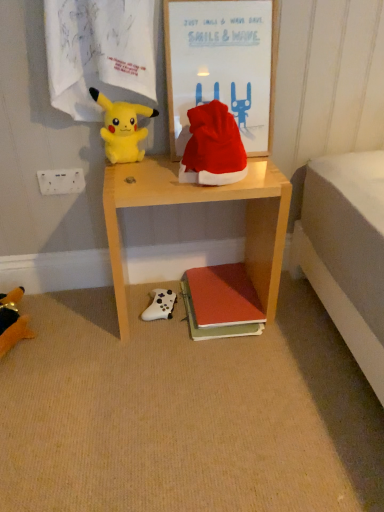
Locate an element on the screen. Image resolution: width=384 pixels, height=512 pixels. wooden desk at center is located at coordinates (200, 202).

From the picture: Measure the distance between point (22, 324) and camera.

They are 1.37 meters apart.

Measure the distance between matte orange book at lower center and camera.

A distance of 4.39 feet exists between matte orange book at lower center and camera.

Describe the element at coordinates (221, 302) in the screenshot. I see `matte orange book at lower center` at that location.

This screenshot has height=512, width=384. I want to click on yellow plush toy at upper left, placed as the 2th toy when sorted from right to left, so click(122, 128).

What do you see at coordinates (122, 128) in the screenshot?
I see `yellow plush toy at upper left, the 2th toy when ordered from left to right` at bounding box center [122, 128].

Locate an element on the screen. white matte game controller at lower center, the first toy positioned from the right is located at coordinates (160, 305).

Would you consider wooden framed poster at upper center to be distant from red velvet santa hat at center?

wooden framed poster at upper center is actually quite close to red velvet santa hat at center.

Can you confirm if wooden framed poster at upper center is thinner than red velvet santa hat at center?

Yes, wooden framed poster at upper center is thinner than red velvet santa hat at center.

Is wooden framed poster at upper center oriented towards red velvet santa hat at center?

Yes, wooden framed poster at upper center faces towards red velvet santa hat at center.

How much distance is there between wooden framed poster at upper center and red velvet santa hat at center?

wooden framed poster at upper center and red velvet santa hat at center are 7.90 inches apart.

Measure the distance between soft plush toy at lower left, positioned as the first toy in left-to-right order, and yellow plush toy at upper left, the 2th toy when ordered from left to right.

soft plush toy at lower left, positioned as the first toy in left-to-right order, and yellow plush toy at upper left, the 2th toy when ordered from left to right, are 64.40 centimeters apart.

Is soft plush toy at lower left, positioned as the first toy in left-to-right order, located outside yellow plush toy at upper left, the 2th toy when ordered from left to right?

Indeed, soft plush toy at lower left, positioned as the first toy in left-to-right order, is completely outside yellow plush toy at upper left, the 2th toy when ordered from left to right.

In the scene shown: Which of these two, soft plush toy at lower left, the 3th toy when ordered from top to bottom, or yellow plush toy at upper left, which ranks as the 3th toy in bottom-to-top order, is wider?

With larger width is soft plush toy at lower left, the 3th toy when ordered from top to bottom.

Which object is more forward, white matte game controller at lower center, acting as the third toy starting from the left, or red velvet santa hat at center?

red velvet santa hat at center is closer to the camera.

How different are the orientations of white matte game controller at lower center, acting as the third toy starting from the left, and red velvet santa hat at center in degrees?

13.6 degrees separate the facing orientations of white matte game controller at lower center, acting as the third toy starting from the left, and red velvet santa hat at center.

From the picture: Which of these two, white matte game controller at lower center, which ranks as the 2th toy in bottom-to-top order, or red velvet santa hat at center, is wider?

white matte game controller at lower center, which ranks as the 2th toy in bottom-to-top order, is wider.

From the image's perspective, is white matte game controller at lower center, acting as the third toy starting from the left, over red velvet santa hat at center?

→ No.

Is matte orange book at lower center turned away from white matte game controller at lower center, the first toy positioned from the right?

That's not correct — matte orange book at lower center is not looking away from white matte game controller at lower center, the first toy positioned from the right.

This screenshot has width=384, height=512. In order to click on book in front of the white matte game controller at lower center, which ranks as the 2th toy in bottom-to-top order in this screenshot , I will do `click(221, 302)`.

Does point (239, 295) lie in front of point (152, 293)?

Yes, point (239, 295) is closer to viewer.

Would you say matte orange book at lower center contains white matte game controller at lower center, acting as the third toy starting from the left?

No, white matte game controller at lower center, acting as the third toy starting from the left, is located outside of matte orange book at lower center.

Is red velvet santa hat at center positioned before white matte game controller at lower center, which ranks as the 2th toy in bottom-to-top order?

Yes, red velvet santa hat at center is closer to the viewer.

Find the location of a particular element. This screenshot has height=512, width=384. hat in front of the white matte game controller at lower center, the first toy positioned from the right is located at coordinates (213, 147).

In the scene shown: From the image's perspective, who appears lower, red velvet santa hat at center or white matte game controller at lower center, which ranks as the 2th toy in bottom-to-top order?

white matte game controller at lower center, which ranks as the 2th toy in bottom-to-top order, from the image's perspective.

Do you think red velvet santa hat at center is within white matte game controller at lower center, the first toy positioned from the right, or outside of it?

red velvet santa hat at center is not inside white matte game controller at lower center, the first toy positioned from the right, it's outside.

Which is in front, point (167, 294) or point (19, 293)?

The point (19, 293) is closer to the camera.

Considering the sizes of objects white matte game controller at lower center, the first toy positioned from the right, and soft plush toy at lower left, placed as the 3th toy when sorted from right to left, in the image provided, who is thinner, white matte game controller at lower center, the first toy positioned from the right, or soft plush toy at lower left, placed as the 3th toy when sorted from right to left,?

With smaller width is white matte game controller at lower center, the first toy positioned from the right.

Considering the sizes of objects white matte game controller at lower center, which ranks as the 2th toy in bottom-to-top order, and soft plush toy at lower left, placed as the first toy when sorted from bottom to top, in the image provided, who is bigger, white matte game controller at lower center, which ranks as the 2th toy in bottom-to-top order, or soft plush toy at lower left, placed as the first toy when sorted from bottom to top,?

soft plush toy at lower left, placed as the first toy when sorted from bottom to top.

From the image's perspective, between white matte game controller at lower center, acting as the third toy starting from the left, and soft plush toy at lower left, placed as the first toy when sorted from bottom to top, which one is located above?

From the image's view, white matte game controller at lower center, acting as the third toy starting from the left, is above.

Can you confirm if white matte game controller at lower center, which ranks as the 2th toy in bottom-to-top order, is shorter than wooden desk at center?

Indeed, white matte game controller at lower center, which ranks as the 2th toy in bottom-to-top order, has a lesser height compared to wooden desk at center.

Does white matte game controller at lower center, the second toy positioned from the top, appear on the left side of wooden desk at center?

Correct, you'll find white matte game controller at lower center, the second toy positioned from the top, to the left of wooden desk at center.

This screenshot has width=384, height=512. I want to click on desk lying above the white matte game controller at lower center, acting as the third toy starting from the left (from the image's perspective), so click(x=200, y=202).

Locate an element on the screen. Image resolution: width=384 pixels, height=512 pixels. hat lying below the wooden framed poster at upper center (from the image's perspective) is located at coordinates (213, 147).

This screenshot has height=512, width=384. Find the location of `toy that appears on the left of yellow plush toy at upper left, the 2th toy when ordered from left to right`. toy that appears on the left of yellow plush toy at upper left, the 2th toy when ordered from left to right is located at coordinates [12, 321].

From the image, which object appears to be nearer to yellow plush toy at upper left, the 2th toy when ordered from left to right, matte orange book at lower center or white matte game controller at lower center, the second toy positioned from the top?

white matte game controller at lower center, the second toy positioned from the top, is closer to yellow plush toy at upper left, the 2th toy when ordered from left to right.

Based on their spatial positions, is wooden framed poster at upper center or white matte game controller at lower center, acting as the third toy starting from the left, further from white plastic power outlet at upper left?

wooden framed poster at upper center is positioned further to the anchor white plastic power outlet at upper left.

Which object lies nearer to the anchor point white plastic power outlet at upper left, wooden framed poster at upper center or wooden desk at center?

Based on the image, wooden desk at center appears to be nearer to white plastic power outlet at upper left.

Considering their positions, is red velvet santa hat at center positioned closer to soft plush toy at lower left, positioned as the first toy in left-to-right order, than wooden desk at center?

Among the two, wooden desk at center is located nearer to soft plush toy at lower left, positioned as the first toy in left-to-right order.

Considering their positions, is wooden framed poster at upper center positioned further to white plastic power outlet at upper left than red velvet santa hat at center?

wooden framed poster at upper center is positioned further to the anchor white plastic power outlet at upper left.

When comparing their distances from soft plush toy at lower left, positioned as the first toy in left-to-right order, does wooden desk at center or white matte game controller at lower center, the second toy positioned from the top, seem further?

wooden desk at center is positioned further to the anchor soft plush toy at lower left, positioned as the first toy in left-to-right order.

Looking at the image, which one is located further to soft plush toy at lower left, positioned as the first toy in left-to-right order, white matte game controller at lower center, the second toy positioned from the top, or wooden framed poster at upper center?

wooden framed poster at upper center is further to soft plush toy at lower left, positioned as the first toy in left-to-right order.

Looking at the image, which one is located further to white plastic power outlet at upper left, white matte game controller at lower center, the first toy positioned from the right, or wooden framed poster at upper center?

wooden framed poster at upper center lies further to white plastic power outlet at upper left than the other object.

You are a GUI agent. You are given a task and a screenshot of the screen. Output one action in this format:
    pyautogui.click(x=<x>, y=<y>)
    Task: Click on the toy between wooden framed poster at upper center and white matte game controller at lower center, which ranks as the 2th toy in bottom-to-top order, from top to bottom
    Image resolution: width=384 pixels, height=512 pixels.
    Given the screenshot: What is the action you would take?
    pyautogui.click(x=122, y=128)

At what (x,y) coordinates should I click in order to perform the action: click on toy between white plastic power outlet at upper left and soft plush toy at lower left, positioned as the first toy in left-to-right order, vertically. Please return your answer as a coordinate pair (x, y). This screenshot has width=384, height=512. Looking at the image, I should click on (160, 305).

Where is `hat between yellow plush toy at upper left, which is the first toy in top-to-bottom order, and wooden framed poster at upper center from left to right`? The image size is (384, 512). hat between yellow plush toy at upper left, which is the first toy in top-to-bottom order, and wooden framed poster at upper center from left to right is located at coordinates (213, 147).

The image size is (384, 512). I want to click on book between wooden framed poster at upper center and white matte game controller at lower center, which ranks as the 2th toy in bottom-to-top order, vertically, so click(x=221, y=302).